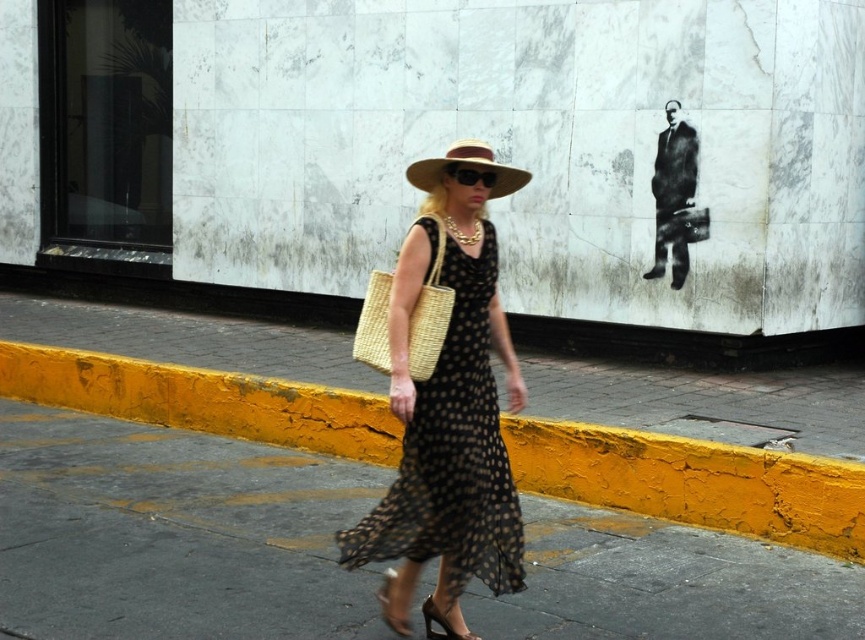
Question: Which point is farther to the camera?

Choices:
 (A) (773, 538)
 (B) (356, 326)
 (C) (457, 637)
 (D) (501, 192)

Answer: (B)

Question: Is brown straw hat at center positioned at the back of shiny brown leather sandal at lower center?

Choices:
 (A) yes
 (B) no

Answer: (B)

Question: Which object is positioned farthest from the woven straw bag at center?

Choices:
 (A) shiny gold sandal at lower center
 (B) brown straw hat at center
 (C) shiny brown leather sandal at lower center

Answer: (A)

Question: Which object is farther from the camera taking this photo?

Choices:
 (A) black dotted fabric dress at center
 (B) brown straw hat at center

Answer: (A)

Question: Where is yellow painted curb at lower center located in relation to woven straw bag at center in the image?

Choices:
 (A) right
 (B) left

Answer: (A)

Question: Is yellow painted curb at lower center above black dotted fabric dress at center?

Choices:
 (A) no
 (B) yes

Answer: (A)